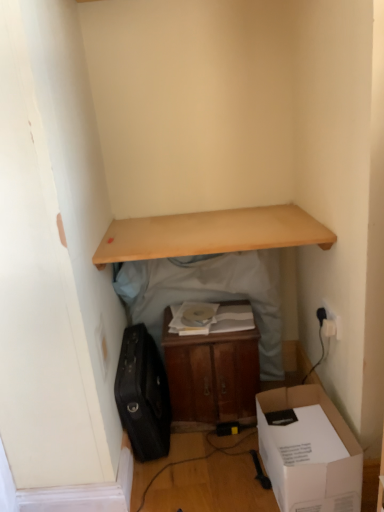
Question: From the image's perspective, is black leather suitcase at lower left on top of white plastic electric outlet at upper right?

Choices:
 (A) no
 (B) yes

Answer: (A)

Question: Is black leather suitcase at lower left thinner than white plastic electric outlet at upper right?

Choices:
 (A) no
 (B) yes

Answer: (A)

Question: Can you confirm if black leather suitcase at lower left is shorter than white plastic electric outlet at upper right?

Choices:
 (A) no
 (B) yes

Answer: (A)

Question: Is black leather suitcase at lower left in front of white plastic electric outlet at upper right?

Choices:
 (A) yes
 (B) no

Answer: (B)

Question: Is black leather suitcase at lower left at the left side of white plastic electric outlet at upper right?

Choices:
 (A) yes
 (B) no

Answer: (A)

Question: From a real-world perspective, is black leather suitcase at lower left located beneath white plastic electric outlet at upper right?

Choices:
 (A) no
 (B) yes

Answer: (B)

Question: Is light wood shelf at upper center shorter than wooden cabinet at center, the second table in the right-to-left sequence?

Choices:
 (A) no
 (B) yes

Answer: (B)

Question: Is light wood shelf at upper center located outside wooden cabinet at center, the second table in the right-to-left sequence?

Choices:
 (A) yes
 (B) no

Answer: (A)

Question: Does light wood shelf at upper center appear on the right side of wooden cabinet at center, marked as the 1th table in a left-to-right arrangement?

Choices:
 (A) yes
 (B) no

Answer: (B)

Question: Does light wood shelf at upper center have a greater width compared to wooden cabinet at center, the second table in the right-to-left sequence?

Choices:
 (A) yes
 (B) no

Answer: (A)

Question: Is wooden cabinet at center, the second table in the right-to-left sequence, inside light wood shelf at upper center?

Choices:
 (A) yes
 (B) no

Answer: (B)

Question: From a real-world perspective, is light wood shelf at upper center beneath wooden cabinet at center, the second table in the right-to-left sequence?

Choices:
 (A) yes
 (B) no

Answer: (B)

Question: Can you confirm if white plastic electric outlet at upper right is bigger than wooden shelf at upper center, placed as the 1th table when sorted from right to left?

Choices:
 (A) no
 (B) yes

Answer: (A)